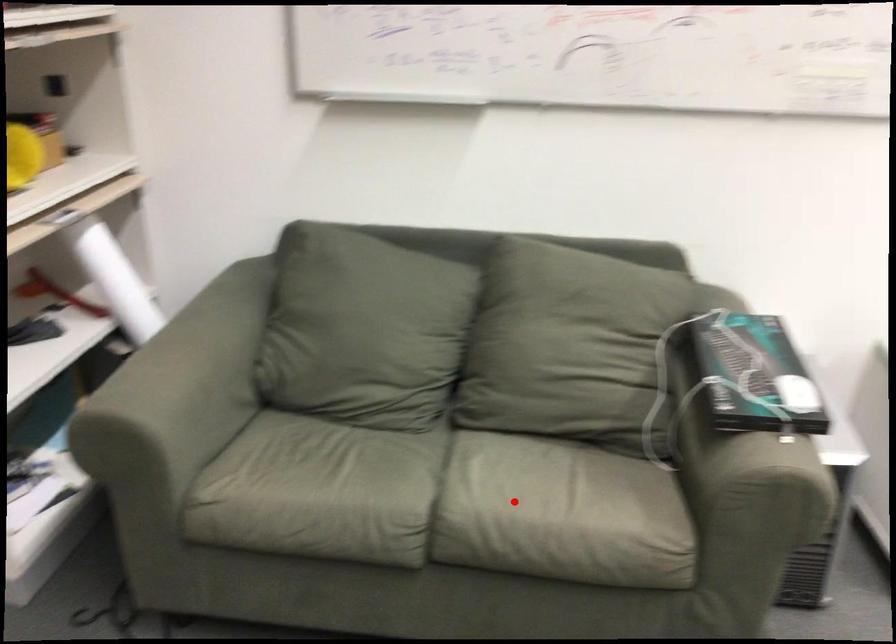
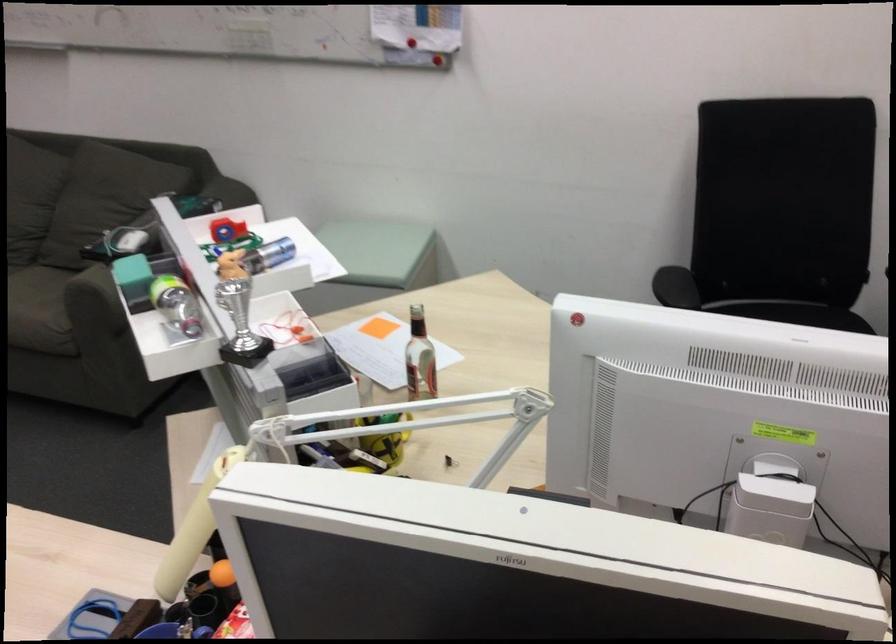
Question: I am providing you with two images of the same scene from different viewpoints. Given a red point in image1, look at the same physical point in image2. Is it:

Choices:
 (A) Closer to the viewpoint
 (B) Farther from the viewpoint

Answer: (B)